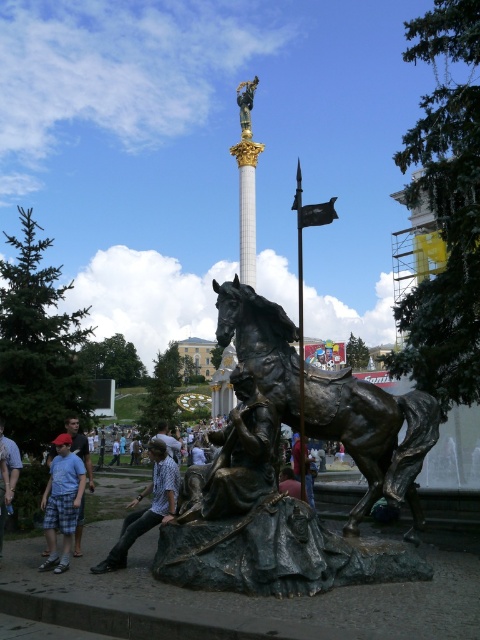
Question: Can you confirm if blue plaid shorts at lower left is thinner than bronze spear at center?

Choices:
 (A) no
 (B) yes

Answer: (B)

Question: Which object is farther from the camera taking this photo?

Choices:
 (A) plaid shirt at lower center
 (B) light blue denim jeans at lower center

Answer: (B)

Question: Is blue plaid shorts at lower left smaller than bronze spear at center?

Choices:
 (A) yes
 (B) no

Answer: (A)

Question: Which of the following is the farthest from the observer?

Choices:
 (A) click(248, 97)
 (B) click(300, 241)

Answer: (B)

Question: Can you confirm if bronze metallic horse at center is bigger than blue plaid shorts at lower left?

Choices:
 (A) yes
 (B) no

Answer: (A)

Question: Among these points, which one is farthest from the camera?

Choices:
 (A) (162, 516)
 (B) (303, 406)
 (C) (374, 472)
 (D) (158, 424)

Answer: (D)